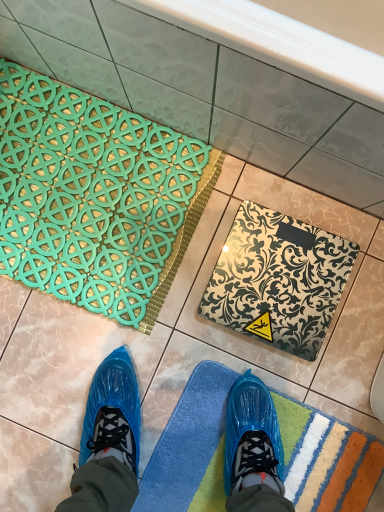
Question: From their relative heights in the image, would you say metallic silver scale at center, the 2th bath mat from the bottom, is taller or shorter than teal rubber bath mat at upper left, which is counted as the 3th bath mat, starting from the bottom?

Choices:
 (A) short
 (B) tall

Answer: (B)

Question: In the image, is metallic silver scale at center, the 2th bath mat positioned from the top, positioned in front of or behind teal rubber bath mat at upper left, which is counted as the 3th bath mat, starting from the bottom?

Choices:
 (A) front
 (B) behind

Answer: (A)

Question: Which object is positioned farthest from the metallic silver scale at center, the 2th bath mat from the bottom?

Choices:
 (A) teal rubber bath mat at upper left, the 1th bath mat from the top
 (B) blue textured bath mat at lower center, which is the first bath mat from bottom to top

Answer: (A)

Question: Estimate the real-world distances between objects in this image. Which object is closer to the blue textured bath mat at lower center, positioned as the 3th bath mat in top-to-bottom order?

Choices:
 (A) teal rubber bath mat at upper left, the 1th bath mat from the top
 (B) metallic silver scale at center, the 2th bath mat from the bottom

Answer: (B)